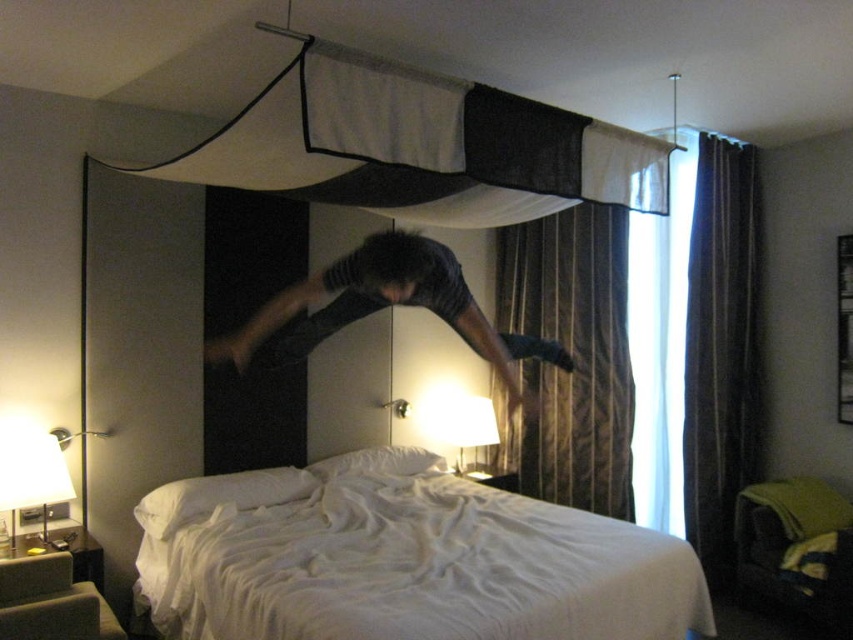
You are a hotel guest who wants to make sure your luggage fits under the bed. The bed is white soft bed at center and there is a white fabric canopy at upper center above it. Based on their sizes, can you tell if the bed is wide enough to accommodate a standard size luggage underneath?

The white soft bed at center is wider than the white fabric canopy at upper center. Since the bed is wider, it likely has enough space underneath to fit a standard size luggage.

You are a hotel guest who wants to hang a picture frame on the wall behind the white soft bed at center. Can you see the wall behind the white fabric canopy at upper center when looking from the bed area?

The white fabric canopy at upper center is behind the white soft bed at center, so when looking from the bed area, the wall behind the white fabric canopy at upper center would not be visible as the bed is in front of it.

Looking at this image, you are a hotel guest who wants to ensure privacy. You notice the brown striped curtain at center and the dark gray fabric at center. Which one should you pull down to block the view from the window?

Result: The brown striped curtain at center is taller than the dark gray fabric at center, so pulling down the brown striped curtain at center would provide better coverage and privacy from the window.